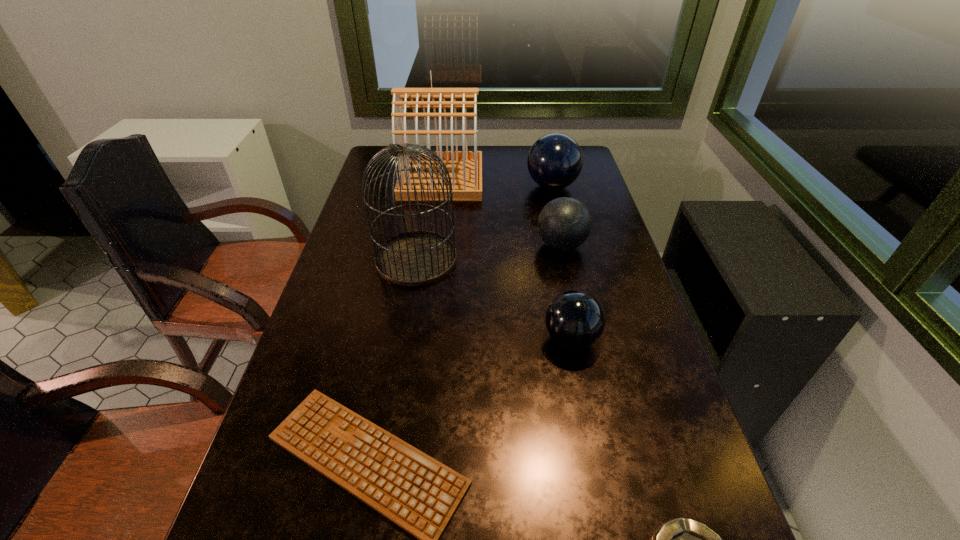
Find the location of a particular element. This screenshot has height=540, width=960. vacant point located on the surface of the farthest bowling ball near the finger holes is located at coordinates (494, 186).

Where is `free space located on the grip area of the second nearest bowling ball`? The width and height of the screenshot is (960, 540). free space located on the grip area of the second nearest bowling ball is located at coordinates (406, 245).

The image size is (960, 540). Identify the location of vacant space located on the grip area of the second nearest bowling ball. (461, 245).

Identify the location of vacant space located on the grip area of the second nearest bowling ball. (441, 245).

Find the location of a particular element. Image resolution: width=960 pixels, height=540 pixels. blank area located on the side of the nearest bowling ball with the finger holes is located at coordinates (470, 339).

The width and height of the screenshot is (960, 540). I want to click on blank area located 0.300m on the side of the nearest bowling ball with the finger holes, so click(x=415, y=339).

Where is `blank area located on the side of the nearest bowling ball with the finger holes`? blank area located on the side of the nearest bowling ball with the finger holes is located at coordinates (397, 339).

You are a GUI agent. You are given a task and a screenshot of the screen. Output one action in this format:
    pyautogui.click(x=<x>, y=<y>)
    Task: Click on the birdcage located in the far edge section of the desktop
    This screenshot has height=540, width=960.
    Given the screenshot: What is the action you would take?
    pyautogui.click(x=465, y=167)

You are a GUI agent. You are given a task and a screenshot of the screen. Output one action in this format:
    pyautogui.click(x=<x>, y=<y>)
    Task: Click on the bowling ball located at the far edge
    This screenshot has height=540, width=960.
    Given the screenshot: What is the action you would take?
    pyautogui.click(x=555, y=160)

Where is `object that is at the far left corner`? Image resolution: width=960 pixels, height=540 pixels. object that is at the far left corner is located at coordinates (465, 167).